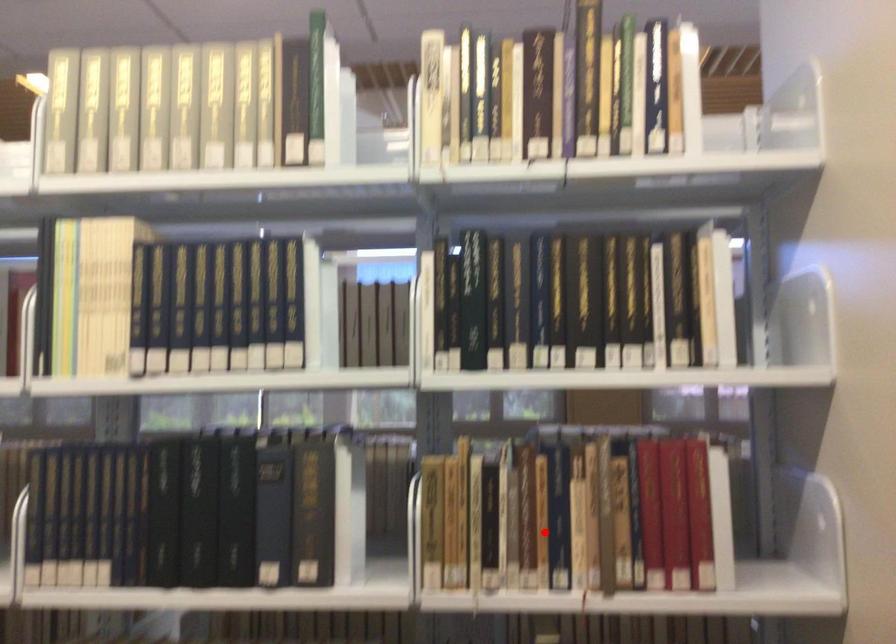
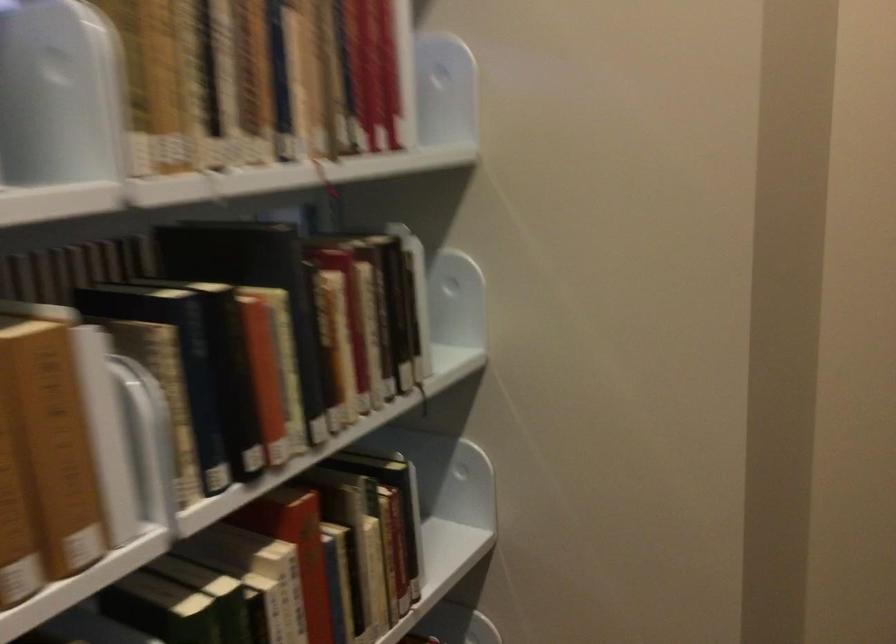
In the second image, find the point that corresponds to the highlighted location in the first image.

(260, 80)